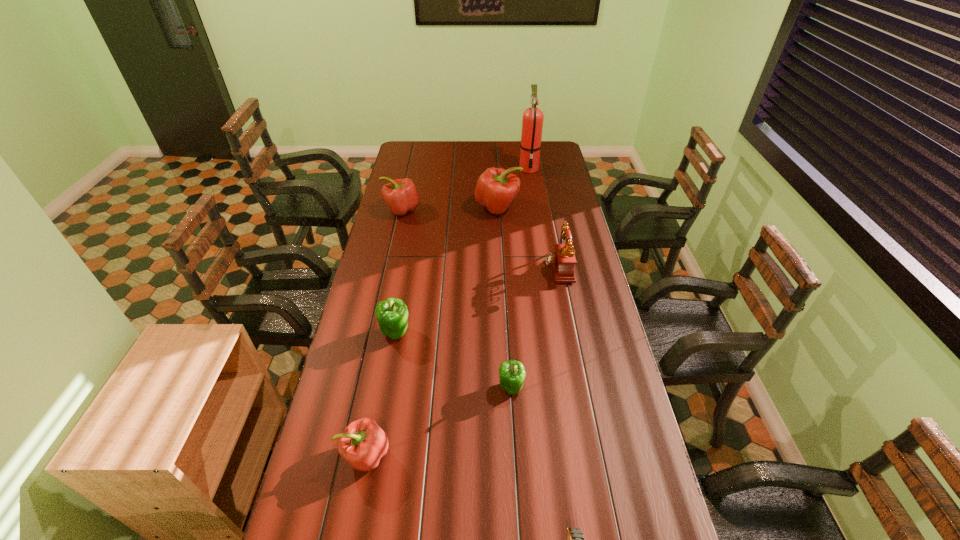
The height and width of the screenshot is (540, 960). I want to click on the nearest pink bell pepper, so click(363, 443).

I want to click on free space located on the hose direction of the fire extinguisher, so click(532, 185).

Where is `vacant space located on the front of the biggest pink bell pepper`? This screenshot has width=960, height=540. vacant space located on the front of the biggest pink bell pepper is located at coordinates (500, 251).

Locate an element on the screen. This screenshot has width=960, height=540. free space located on the dial of the fifth nearest object is located at coordinates (516, 267).

I want to click on free space located 0.240m on the dial of the fifth nearest object, so click(x=485, y=267).

Identify the location of free location located on the dial of the fifth nearest object. (447, 267).

In order to click on vacant region located on the right of the bigger green bell pepper in this screenshot , I will do `click(425, 332)`.

This screenshot has height=540, width=960. Find the location of `free space located 0.200m on the front of the second biggest pink bell pepper`. free space located 0.200m on the front of the second biggest pink bell pepper is located at coordinates (393, 248).

Where is `vacant space located on the back of the second nearest bell pepper`? vacant space located on the back of the second nearest bell pepper is located at coordinates (509, 346).

Image resolution: width=960 pixels, height=540 pixels. Find the location of `blank space located 0.160m on the right of the seventh farthest object`. blank space located 0.160m on the right of the seventh farthest object is located at coordinates (448, 455).